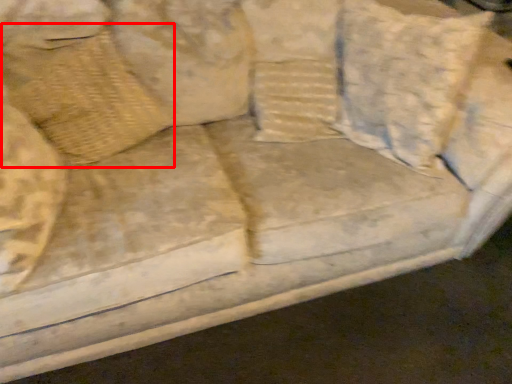
Question: From the image, what is the correct spatial relationship of pillow (annotated by the red box) in relation to pillow?

Choices:
 (A) left
 (B) right

Answer: (A)